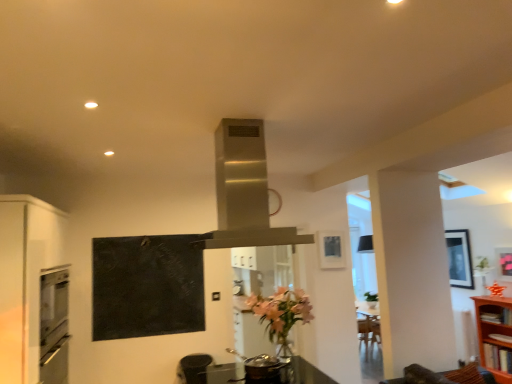
What are the coordinates of `wooden bookshelf at right, acting as the first shelf starting from the bottom` in the screenshot? It's located at (492, 331).

Where is `matte white oven at left`? matte white oven at left is located at coordinates (54, 324).

Locate an element on the screen. matte black picture frame at upper center, which is counted as the 1th picture frame, starting from the left is located at coordinates (331, 250).

Considering the sizes of objects wooden bookshelf at right, acting as the first shelf starting from the bottom, and stainless steel exhaust hood at center in the image provided, who is wider, wooden bookshelf at right, acting as the first shelf starting from the bottom, or stainless steel exhaust hood at center?

With larger width is stainless steel exhaust hood at center.

From their relative heights in the image, would you say wooden bookshelf at right, acting as the first shelf starting from the bottom, is taller or shorter than stainless steel exhaust hood at center?

wooden bookshelf at right, acting as the first shelf starting from the bottom, is taller than stainless steel exhaust hood at center.

From a real-world perspective, which object rests below the other?

wooden bookshelf at right, acting as the first shelf starting from the bottom, is physically lower.

Where is `exhaust hood that appears on the left of wooden bookshelf at right, acting as the first shelf starting from the bottom`? The width and height of the screenshot is (512, 384). exhaust hood that appears on the left of wooden bookshelf at right, acting as the first shelf starting from the bottom is located at coordinates (244, 190).

In the scene shown: Is matte white oven at left in front of or behind stainless steel exhaust hood at center in the image?

Visually, matte white oven at left is located behind stainless steel exhaust hood at center.

Is matte white oven at left wider than stainless steel exhaust hood at center?

In fact, matte white oven at left might be narrower than stainless steel exhaust hood at center.

I want to click on oven on the left of stainless steel exhaust hood at center, so click(54, 324).

Consider the image. Which is less distant, (60, 313) or (251, 153)?

Point (251, 153)

From a real-world perspective, who is located lower, stainless steel exhaust hood at center or matte black picture frame at upper center, which ranks as the first picture frame in front-to-back order?

matte black picture frame at upper center, which ranks as the first picture frame in front-to-back order, is physically lower.

Which object is thinner, stainless steel exhaust hood at center or matte black picture frame at upper center, which appears as the third picture frame when viewed from the back?

matte black picture frame at upper center, which appears as the third picture frame when viewed from the back.

Is stainless steel exhaust hood at center not near matte black picture frame at upper center, which appears as the third picture frame when viewed from the back?

stainless steel exhaust hood at center is positioned a significant distance from matte black picture frame at upper center, which appears as the third picture frame when viewed from the back.

What's the angular difference between matte black picture frame at upper center, which is counted as the 1th picture frame, starting from the left, and matte white oven at left's facing directions?

92 degrees.

Is matte black picture frame at upper center, which is counted as the 1th picture frame, starting from the left, not within matte white oven at left?

That's correct, matte black picture frame at upper center, which is counted as the 1th picture frame, starting from the left, is outside of matte white oven at left.

Where is `picture frame that is the 3rd object located above the matte white oven at left (from the image's perspective)`? The width and height of the screenshot is (512, 384). picture frame that is the 3rd object located above the matte white oven at left (from the image's perspective) is located at coordinates (331, 250).

Between wooden bookshelf at right, which ranks as the second shelf in top-to-bottom order, and matte black picture frame at upper center, which appears as the third picture frame when viewed from the right, which one is positioned in front?

wooden bookshelf at right, which ranks as the second shelf in top-to-bottom order.

Does wooden bookshelf at right, which ranks as the second shelf in top-to-bottom order, have a smaller size compared to matte black picture frame at upper center, which is counted as the 1th picture frame, starting from the left?

No, wooden bookshelf at right, which ranks as the second shelf in top-to-bottom order, is not smaller than matte black picture frame at upper center, which is counted as the 1th picture frame, starting from the left.

From the image's perspective, does wooden bookshelf at right, which ranks as the second shelf in top-to-bottom order, appear lower than matte black picture frame at upper center, which appears as the third picture frame when viewed from the right?

Yes.

Considering the relative sizes of wooden bookshelf at right, acting as the first shelf starting from the bottom, and matte black picture frame at upper center, which ranks as the first picture frame in front-to-back order, in the image provided, is wooden bookshelf at right, acting as the first shelf starting from the bottom, shorter than matte black picture frame at upper center, which ranks as the first picture frame in front-to-back order,?

No.

Considering the relative sizes of matte white oven at left and matte black trash can at lower center in the image provided, is matte white oven at left wider than matte black trash can at lower center?

Incorrect, the width of matte white oven at left does not surpass that of matte black trash can at lower center.

Which point is more distant from viewer, (47,273) or (182,380)?

The point (47,273) is more distant.

From the image's perspective, is matte white oven at left above or below matte black trash can at lower center?

Clearly, from the image's perspective, matte white oven at left is above matte black trash can at lower center.

From a real-world perspective, is matte white oven at left over matte black trash can at lower center?

Yes.

Which object is further away from the camera taking this photo, wooden bookshelf at right, which ranks as the second shelf in top-to-bottom order, or brown wooden shelf at right, the 1th shelf from the top?

Positioned behind is brown wooden shelf at right, the 1th shelf from the top.

Which is behind, point (511, 327) or point (499, 316)?

The point (499, 316) is behind.

You are a GUI agent. You are given a task and a screenshot of the screen. Output one action in this format:
    pyautogui.click(x=<x>, y=<y>)
    Task: Click on the exhaust hood that appears in front of the wooden bookshelf at right, which ranks as the second shelf in top-to-bottom order
    
    Given the screenshot: What is the action you would take?
    244,190

In the image, there is a stainless steel exhaust hood at center. Where is `oven below it (from a real-world perspective)`? oven below it (from a real-world perspective) is located at coordinates (54, 324).

Considering their positions, is stainless steel exhaust hood at center positioned closer to wooden bookshelf at right, which ranks as the second shelf in top-to-bottom order, than brown wooden shelf at right, the 1th shelf from the top?

brown wooden shelf at right, the 1th shelf from the top, is closer to wooden bookshelf at right, which ranks as the second shelf in top-to-bottom order.

Based on their spatial positions, is wooden bookshelf at right, acting as the first shelf starting from the bottom, or black matte chalkboard at upper left closer to matte black picture frame at right, the second picture frame viewed from the right?

wooden bookshelf at right, acting as the first shelf starting from the bottom, is positioned closer to the anchor matte black picture frame at right, the second picture frame viewed from the right.

Looking at the image, which one is located closer to matte white oven at left, wooden bookshelf at right, acting as the first shelf starting from the bottom, or black matte chalkboard at upper left?

black matte chalkboard at upper left.

From the picture: Based on their spatial positions, is matte black picture frame at upper center, which ranks as the first picture frame in front-to-back order, or wooden bookshelf at right, acting as the first shelf starting from the bottom, closer to black matte chalkboard at upper left?

matte black picture frame at upper center, which ranks as the first picture frame in front-to-back order, lies closer to black matte chalkboard at upper left than the other object.

Based on their spatial positions, is matte white oven at left or wooden bookshelf at right, which ranks as the second shelf in top-to-bottom order, closer to black matte chalkboard at upper left?

Among the two, matte white oven at left is located nearer to black matte chalkboard at upper left.

Estimate the real-world distances between objects in this image. Which object is further from matte black picture frame at upper center, which ranks as the first picture frame in front-to-back order, brown wooden shelf at right, marked as the 2th shelf in a bottom-to-top arrangement, or matte black picture frame at right, which is the third picture frame in front-to-back order?

matte black picture frame at right, which is the third picture frame in front-to-back order, is positioned further to the anchor matte black picture frame at upper center, which ranks as the first picture frame in front-to-back order.

Which object lies nearer to the anchor point brown wooden shelf at right, marked as the 2th shelf in a bottom-to-top arrangement, matte black picture frame at upper center, which is counted as the 1th picture frame, starting from the left, or matte black picture frame at upper right, the 2th picture frame in the front-to-back sequence?

matte black picture frame at upper right, the 2th picture frame in the front-to-back sequence, is closer to brown wooden shelf at right, marked as the 2th shelf in a bottom-to-top arrangement.

Which object lies nearer to the anchor point matte black picture frame at upper right, the second picture frame from the back, matte black trash can at lower center or brown wooden shelf at right, the 1th shelf from the top?

brown wooden shelf at right, the 1th shelf from the top, lies closer to matte black picture frame at upper right, the second picture frame from the back, than the other object.

Locate an element on the screen. The image size is (512, 384). shelf between stainless steel exhaust hood at center and wooden bookshelf at right, acting as the first shelf starting from the bottom, in the horizontal direction is located at coordinates (496, 314).

This screenshot has width=512, height=384. Find the location of `picture frame situated between matte black picture frame at upper center, which ranks as the first picture frame in front-to-back order, and wooden bookshelf at right, acting as the first shelf starting from the bottom, from left to right`. picture frame situated between matte black picture frame at upper center, which ranks as the first picture frame in front-to-back order, and wooden bookshelf at right, acting as the first shelf starting from the bottom, from left to right is located at coordinates (459, 258).

Identify the location of exhaust hood situated between black matte chalkboard at upper left and wooden bookshelf at right, which ranks as the second shelf in top-to-bottom order, from left to right. (244, 190).

You are a GUI agent. You are given a task and a screenshot of the screen. Output one action in this format:
    pyautogui.click(x=<x>, y=<y>)
    Task: Click on the picture frame between matte black picture frame at upper center, which is counted as the 1th picture frame, starting from the left, and matte black picture frame at upper right, positioned as the third picture frame in left-to-right order, from left to right
    The height and width of the screenshot is (384, 512).
    Given the screenshot: What is the action you would take?
    pyautogui.click(x=459, y=258)